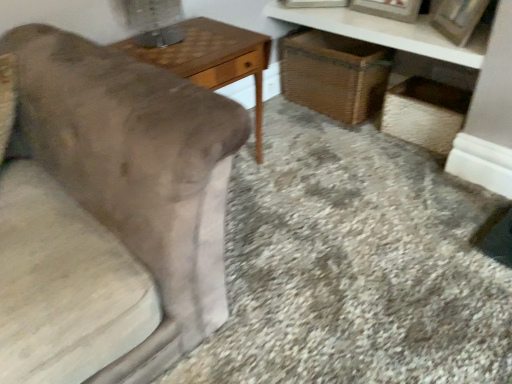
This screenshot has width=512, height=384. I want to click on vacant area that lies in front of metallic silver table lamp at upper left, so click(168, 59).